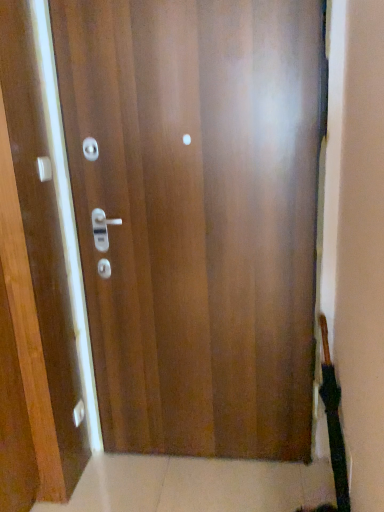
Question: Based on their sizes in the image, would you say matte silver knob at lower left is bigger or smaller than glossy wood door at center?

Choices:
 (A) big
 (B) small

Answer: (B)

Question: From a real-world perspective, is matte silver knob at lower left physically located above or below glossy wood door at center?

Choices:
 (A) below
 (B) above

Answer: (A)

Question: Considering the real-world distances, which object is farthest from the matte white handle at upper left?

Choices:
 (A) glossy wood door at center
 (B) matte silver knob at lower left

Answer: (B)

Question: Which of these objects is positioned closest to the glossy wood door at center?

Choices:
 (A) matte silver knob at lower left
 (B) matte white handle at upper left

Answer: (B)